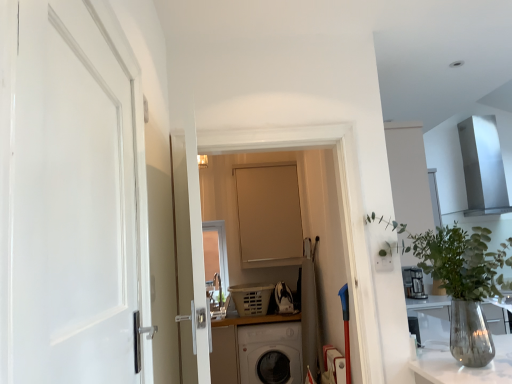
Locate an element on the screen. The height and width of the screenshot is (384, 512). matte beige door at center, the 2th door in the front-to-back sequence is located at coordinates (269, 216).

Find the location of a particular element. The height and width of the screenshot is (384, 512). matte beige door at center, the first door viewed from the right is located at coordinates (269, 216).

Visually, is white matte door at left, the second door positioned from the right, positioned to the left or to the right of clear glass vase at right?

Clearly, white matte door at left, the second door positioned from the right, is on the left of clear glass vase at right in the image.

Can you tell me how much white matte door at left, which is the second door from back to front, and clear glass vase at right differ in facing direction?

white matte door at left, which is the second door from back to front, and clear glass vase at right are facing 88.7 degrees away from each other.

In the image, there is a white matte door at left, the second door positioned from the right. Identify the location of houseplant below it (from a real-world perspective). The image size is (512, 384). (464, 283).

Is white matte door at left, which is the second door from back to front, oriented towards clear glass vase at right?

No, white matte door at left, which is the second door from back to front, is not aimed at clear glass vase at right.

Measure the distance from clear glass vase at right to matte beige door at center, the 2th door in the front-to-back sequence.

1.94 meters.

Does clear glass vase at right have a lesser width compared to matte beige door at center, the 2th door in the front-to-back sequence?

In fact, clear glass vase at right might be wider than matte beige door at center, the 2th door in the front-to-back sequence.

In the scene shown: Considering the sizes of objects clear glass vase at right and matte beige door at center, the 2th door in the front-to-back sequence, in the image provided, who is bigger, clear glass vase at right or matte beige door at center, the 2th door in the front-to-back sequence,?

With larger size is clear glass vase at right.

In the scene shown: Is matte beige door at center, arranged as the first door when viewed from the back, located within clear glass vase at right?

Definitely not — matte beige door at center, arranged as the first door when viewed from the back, is not inside clear glass vase at right.

From the picture: Is matte beige door at center, the first door viewed from the right, oriented away from white matte door at left, which appears as the first door when viewed from the left?

No, matte beige door at center, the first door viewed from the right,'s orientation is not away from white matte door at left, which appears as the first door when viewed from the left.

Does matte beige door at center, the first door viewed from the right, have a greater height compared to white matte door at left, which is the second door from back to front?

Correct, matte beige door at center, the first door viewed from the right, is much taller as white matte door at left, which is the second door from back to front.

The height and width of the screenshot is (384, 512). In order to click on door below the white matte door at left, the 1th door when ordered from front to back (from the image's perspective) in this screenshot , I will do `click(269, 216)`.

From a real-world perspective, does matte beige door at center, the 2th door in the front-to-back sequence, sit lower than clear glass vase at right?

No.

In terms of width, does matte beige door at center, the 2th door in the front-to-back sequence, look wider or thinner when compared to clear glass vase at right?

matte beige door at center, the 2th door in the front-to-back sequence, is thinner than clear glass vase at right.

Is matte beige door at center, arranged as the first door when viewed from the back, far away from clear glass vase at right?

Indeed, matte beige door at center, arranged as the first door when viewed from the back, is not near clear glass vase at right.

Which object is further away from the camera taking this photo, white matte door at left, the 1th door when ordered from front to back, or matte beige door at center, the second door when ordered from left to right?

matte beige door at center, the second door when ordered from left to right, is further from the camera.

Find the location of `door below the matte beige door at center, arranged as the first door when viewed from the back (from a real-world perspective)`. door below the matte beige door at center, arranged as the first door when viewed from the back (from a real-world perspective) is located at coordinates (68, 195).

How different are the orientations of white matte door at left, which is the second door from back to front, and matte beige door at center, the 2th door in the front-to-back sequence, in degrees?

They differ by 90.1 degrees in their facing directions.

From the picture: Would you consider clear glass vase at right to be distant from white matte door at left, the second door positioned from the right?

Yes, clear glass vase at right and white matte door at left, the second door positioned from the right, are quite far apart.

How distant is clear glass vase at right from white matte door at left, which appears as the first door when viewed from the left?

The distance of clear glass vase at right from white matte door at left, which appears as the first door when viewed from the left, is 4.97 feet.

From the image's perspective, is clear glass vase at right above or below white matte door at left, the 1th door when ordered from front to back?

Based on their image positions, clear glass vase at right is located beneath white matte door at left, the 1th door when ordered from front to back.

From a real-world perspective, which is physically above, clear glass vase at right or white matte door at left, the 1th door when ordered from front to back?

In real-world perspective, white matte door at left, the 1th door when ordered from front to back, is above.

From a real-world perspective, starting from the clear glass vase at right, which door is the 1st one vertically above it? Please provide its 2D coordinates.

[(68, 195)]

This screenshot has height=384, width=512. I want to click on houseplant to the right of matte beige door at center, arranged as the first door when viewed from the back, so coord(464,283).

Looking at the image, which one is located closer to clear glass vase at right, matte beige door at center, arranged as the first door when viewed from the back, or white matte door at left, the 1th door when ordered from front to back?

The object closer to clear glass vase at right is white matte door at left, the 1th door when ordered from front to back.

Considering their positions, is white matte door at left, the 1th door when ordered from front to back, positioned further to clear glass vase at right than matte beige door at center, the second door when ordered from left to right?

Among the two, matte beige door at center, the second door when ordered from left to right, is located further to clear glass vase at right.

Based on their spatial positions, is matte beige door at center, the second door when ordered from left to right, or clear glass vase at right further from white matte door at left, the second door positioned from the right?

Among the two, matte beige door at center, the second door when ordered from left to right, is located further to white matte door at left, the second door positioned from the right.

Looking at the image, which one is located further to white matte door at left, which is the second door from back to front, clear glass vase at right or matte beige door at center, the first door viewed from the right?

The object further to white matte door at left, which is the second door from back to front, is matte beige door at center, the first door viewed from the right.

Considering their positions, is white matte door at left, the second door positioned from the right, positioned further to matte beige door at center, the 2th door in the front-to-back sequence, than clear glass vase at right?

The object further to matte beige door at center, the 2th door in the front-to-back sequence, is white matte door at left, the second door positioned from the right.

Considering their positions, is clear glass vase at right positioned further to matte beige door at center, the first door viewed from the right, than white matte door at left, the 1th door when ordered from front to back?

The object further to matte beige door at center, the first door viewed from the right, is white matte door at left, the 1th door when ordered from front to back.

The height and width of the screenshot is (384, 512). Identify the location of houseplant between white matte door at left, which is the second door from back to front, and matte beige door at center, the first door viewed from the right, from front to back. (464, 283).